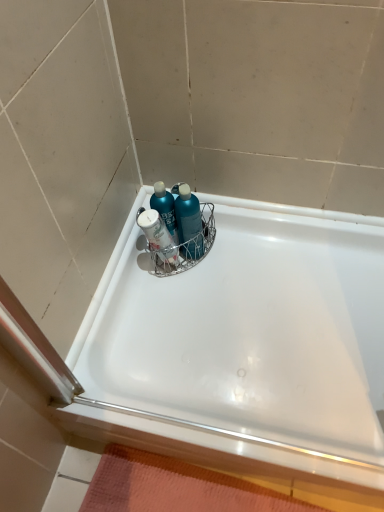
Describe the element at coordinates (189, 223) in the screenshot. I see `teal plastic bottles at center, the 2th cleaning product viewed from the left` at that location.

In order to click on white glossy bathtub at upper center in this screenshot , I will do `click(244, 346)`.

What do you see at coordinates (175, 487) in the screenshot? The width and height of the screenshot is (384, 512). I see `orange textured bath mat at bottom` at bounding box center [175, 487].

What are the coordinates of `white glossy ledge at lower right` in the screenshot? It's located at (219, 447).

Where is `teal plastic bottles at center, placed as the 1th cleaning product when sorted from right to left`? This screenshot has height=512, width=384. teal plastic bottles at center, placed as the 1th cleaning product when sorted from right to left is located at coordinates (189, 223).

In terms of width, does teal glossy shampoo at center, placed as the 2th cleaning product when sorted from right to left, look wider or thinner when compared to white glossy bathtub at upper center?

Clearly, teal glossy shampoo at center, placed as the 2th cleaning product when sorted from right to left, has less width compared to white glossy bathtub at upper center.

Which is in front, point (174, 221) or point (230, 418)?

The point (230, 418) is in front.

Is teal glossy shampoo at center, placed as the 2th cleaning product when sorted from right to left, bigger than white glossy bathtub at upper center?

No, teal glossy shampoo at center, placed as the 2th cleaning product when sorted from right to left, is not bigger than white glossy bathtub at upper center.

Looking at this image, would you consider white glossy ledge at lower right to be distant from orange textured bath mat at bottom?

No, white glossy ledge at lower right is not far away from orange textured bath mat at bottom.

Identify the location of bath mat below the white glossy ledge at lower right (from a real-world perspective). (x=175, y=487).

Can you confirm if white glossy ledge at lower right is positioned to the left of orange textured bath mat at bottom?

Correct, you'll find white glossy ledge at lower right to the left of orange textured bath mat at bottom.

Considering the points (212, 454) and (249, 490), which point is behind, point (212, 454) or point (249, 490)?

The point (249, 490) is farther.

Is orange textured bath mat at bottom shorter than teal plastic bottles at center, the 2th cleaning product viewed from the left?

Yes.

Considering the sizes of objects orange textured bath mat at bottom and teal plastic bottles at center, the 2th cleaning product viewed from the left, in the image provided, who is bigger, orange textured bath mat at bottom or teal plastic bottles at center, the 2th cleaning product viewed from the left,?

orange textured bath mat at bottom is bigger.

Would you say orange textured bath mat at bottom is inside or outside teal plastic bottles at center, placed as the 1th cleaning product when sorted from right to left?

orange textured bath mat at bottom is outside teal plastic bottles at center, placed as the 1th cleaning product when sorted from right to left.

Is orange textured bath mat at bottom aimed at teal plastic bottles at center, placed as the 1th cleaning product when sorted from right to left?

No, orange textured bath mat at bottom is not facing towards teal plastic bottles at center, placed as the 1th cleaning product when sorted from right to left.

How distant is white glossy bathtub at upper center from orange textured bath mat at bottom?

The distance of white glossy bathtub at upper center from orange textured bath mat at bottom is 12.27 inches.

Is point (223, 450) closer or farther from the camera than point (190, 487)?

Point (223, 450) is closer to the camera than point (190, 487).

Is white glossy bathtub at upper center positioned in front of orange textured bath mat at bottom?

No, white glossy bathtub at upper center is further to the viewer.

Which is more to the right, white glossy bathtub at upper center or orange textured bath mat at bottom?

Positioned to the right is white glossy bathtub at upper center.

Is orange textured bath mat at bottom a part of teal glossy bottle at center?

No, orange textured bath mat at bottom is not a part of teal glossy bottle at center.

Looking at their sizes, would you say teal glossy bottle at center is wider or thinner than orange textured bath mat at bottom?

Clearly, teal glossy bottle at center has less width compared to orange textured bath mat at bottom.

Does teal glossy bottle at center have a larger size compared to orange textured bath mat at bottom?

No, teal glossy bottle at center is not bigger than orange textured bath mat at bottom.

From a real-world perspective, is teal glossy bottle at center on top of orange textured bath mat at bottom?

Yes, from a real-world perspective, teal glossy bottle at center is on top of orange textured bath mat at bottom.

Considering the relative sizes of teal glossy shampoo at center, placed as the 2th cleaning product when sorted from right to left, and teal glossy bottle at center in the image provided, is teal glossy shampoo at center, placed as the 2th cleaning product when sorted from right to left, bigger than teal glossy bottle at center?

No.

Which object is positioned more to the right, teal glossy shampoo at center, placed as the 2th cleaning product when sorted from right to left, or teal glossy bottle at center?

From the viewer's perspective, teal glossy shampoo at center, placed as the 2th cleaning product when sorted from right to left, appears more on the right side.

In terms of width, does teal glossy shampoo at center, which is the first cleaning product from left to right, look wider or thinner when compared to teal glossy bottle at center?

Considering their sizes, teal glossy shampoo at center, which is the first cleaning product from left to right, looks broader than teal glossy bottle at center.

From a real-world perspective, between teal glossy shampoo at center, placed as the 2th cleaning product when sorted from right to left, and teal glossy bottle at center, who is vertically higher?

From a 3D spatial view, teal glossy shampoo at center, placed as the 2th cleaning product when sorted from right to left, is above.

Can you tell me how much white glossy bathtub at upper center and teal glossy bottle at center differ in facing direction?

1.5 degrees.

From a real-world perspective, which object rests below the other?

white glossy bathtub at upper center.

In terms of height, does white glossy bathtub at upper center look taller or shorter compared to teal glossy bottle at center?

In the image, white glossy bathtub at upper center appears to be shorter than teal glossy bottle at center.

Is white glossy bathtub at upper center touching teal glossy bottle at center?

No.

From the image's perspective, count 1st cleaning products upward from the white glossy bathtub at upper center and point to it. Please provide its 2D coordinates.

[(165, 208)]

Where is `bath mat on the right of white glossy ledge at lower right`? bath mat on the right of white glossy ledge at lower right is located at coordinates (175, 487).

Which object lies further to the anchor point teal glossy bottle at center, orange textured bath mat at bottom or white glossy ledge at lower right?

Among the two, orange textured bath mat at bottom is located further to teal glossy bottle at center.

Looking at the image, which one is located closer to orange textured bath mat at bottom, white glossy ledge at lower right or teal glossy shampoo at center, which is the first cleaning product from left to right?

white glossy ledge at lower right lies closer to orange textured bath mat at bottom than the other object.

Which object lies nearer to the anchor point orange textured bath mat at bottom, white glossy bathtub at upper center or teal glossy shampoo at center, which is the first cleaning product from left to right?

white glossy bathtub at upper center is closer to orange textured bath mat at bottom.

Looking at the image, which one is located further to teal plastic bottles at center, the 2th cleaning product viewed from the left, orange textured bath mat at bottom or teal glossy shampoo at center, which is the first cleaning product from left to right?

orange textured bath mat at bottom is further to teal plastic bottles at center, the 2th cleaning product viewed from the left.

Considering their positions, is white glossy bathtub at upper center positioned closer to orange textured bath mat at bottom than white glossy ledge at lower right?

white glossy ledge at lower right lies closer to orange textured bath mat at bottom than the other object.

From the image, which object appears to be farther from teal glossy bottle at center, orange textured bath mat at bottom or teal plastic bottles at center, placed as the 1th cleaning product when sorted from right to left?

orange textured bath mat at bottom lies further to teal glossy bottle at center than the other object.

From the image, which object appears to be farther from orange textured bath mat at bottom, teal plastic bottles at center, the 2th cleaning product viewed from the left, or teal glossy shampoo at center, placed as the 2th cleaning product when sorted from right to left?

teal glossy shampoo at center, placed as the 2th cleaning product when sorted from right to left, lies further to orange textured bath mat at bottom than the other object.

Looking at the image, which one is located further to orange textured bath mat at bottom, teal plastic bottles at center, placed as the 1th cleaning product when sorted from right to left, or white glossy ledge at lower right?

teal plastic bottles at center, placed as the 1th cleaning product when sorted from right to left, lies further to orange textured bath mat at bottom than the other object.

This screenshot has width=384, height=512. Find the location of `cleaning product between teal plastic bottles at center, the 2th cleaning product viewed from the left, and orange textured bath mat at bottom, in the vertical direction`. cleaning product between teal plastic bottles at center, the 2th cleaning product viewed from the left, and orange textured bath mat at bottom, in the vertical direction is located at coordinates (165, 208).

The image size is (384, 512). I want to click on bathtub between teal glossy bottle at center and orange textured bath mat at bottom in the vertical direction, so [x=244, y=346].

You are a GUI agent. You are given a task and a screenshot of the screen. Output one action in this format:
    pyautogui.click(x=<x>, y=<y>)
    Task: Click on the mouthwash that lies between teal plastic bottles at center, the 2th cleaning product viewed from the left, and white glossy ledge at lower right from top to bottom
    This screenshot has width=384, height=512.
    Given the screenshot: What is the action you would take?
    pyautogui.click(x=158, y=236)

You are a GUI agent. You are given a task and a screenshot of the screen. Output one action in this format:
    pyautogui.click(x=<x>, y=<y>)
    Task: Click on the bathtub between teal glossy shampoo at center, placed as the 2th cleaning product when sorted from right to left, and orange textured bath mat at bottom in the up-down direction
    This screenshot has width=384, height=512.
    Given the screenshot: What is the action you would take?
    pyautogui.click(x=244, y=346)